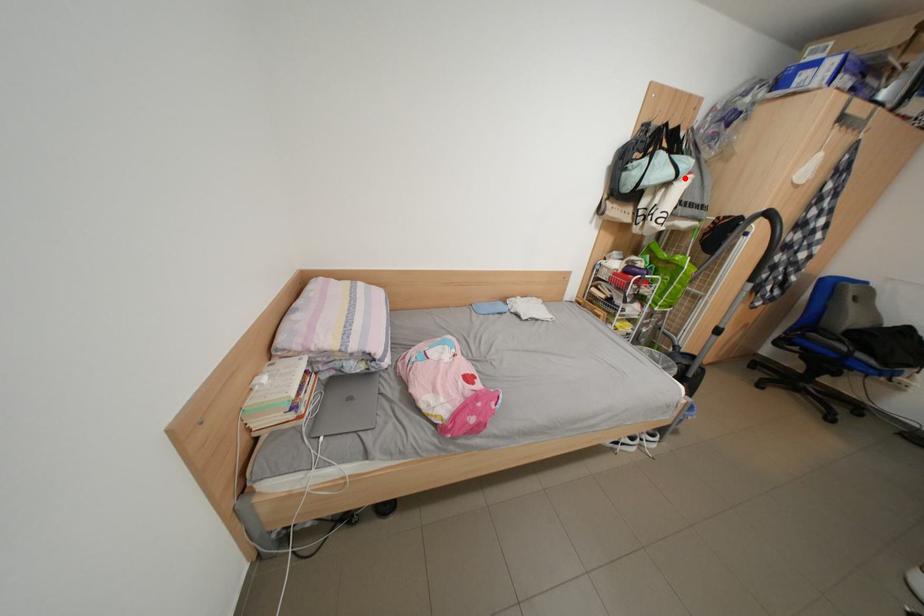
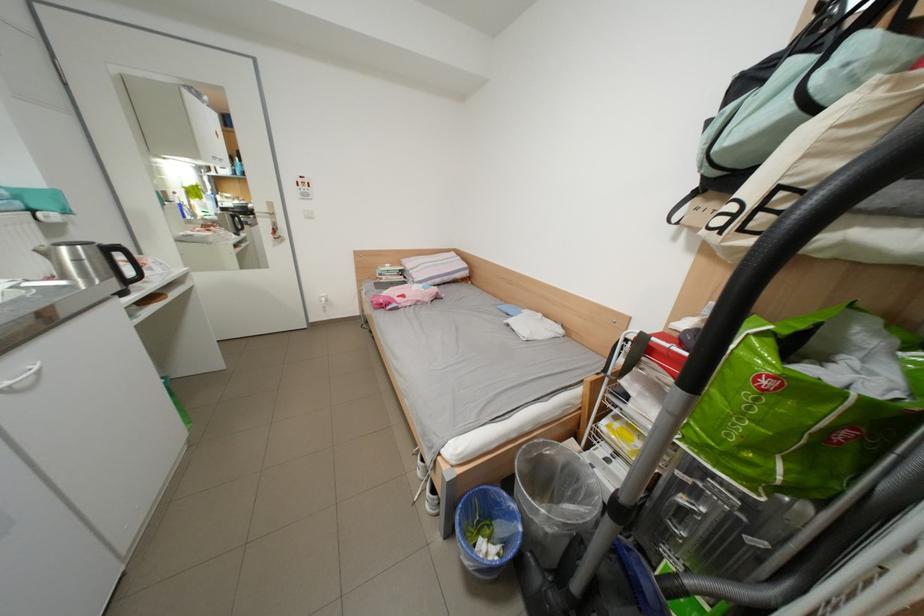
Locate, in the second image, the point that corresponds to the highlighted location in the first image.

(801, 111)